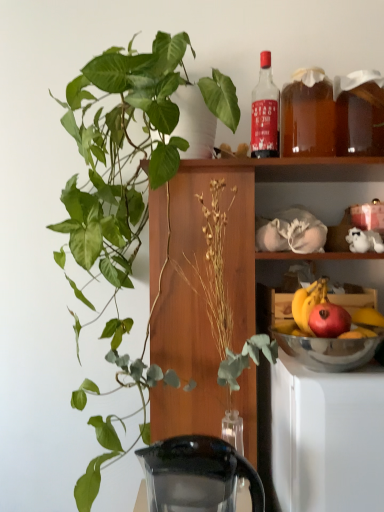
Question: Is red matte apple at right in front of or behind silver metallic bowl at lower right in the image?

Choices:
 (A) front
 (B) behind

Answer: (B)

Question: From a real-world perspective, is red matte apple at right physically located above or below silver metallic bowl at lower right?

Choices:
 (A) above
 (B) below

Answer: (A)

Question: Estimate the real-world distances between objects in this image. Which object is farther from the translucent amber liquid at shelf right, the 2th beverage positioned from the left?

Choices:
 (A) shiny metallic bowl at lower right
 (B) translucent amber liquid at upper right, acting as the second beverage starting from the right
 (C) transparent plastic coffeepot at lower left
 (D) green glossy plant at upper left
 (E) matte glass bottle at upper right

Answer: (C)

Question: Estimate the real-world distances between objects in this image. Which object is closer to the transparent plastic coffeepot at lower left?

Choices:
 (A) translucent amber liquid at upper right, acting as the second beverage starting from the right
 (B) translucent amber liquid at shelf right, which appears as the 1th beverage when viewed from the right
 (C) matte glass bottle at upper right
 (D) red matte apple at right
 (E) green glossy plant at upper left

Answer: (D)